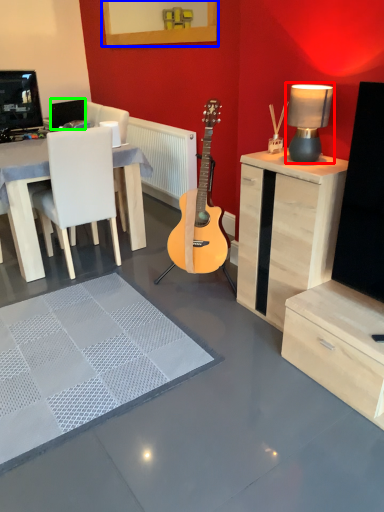
Question: Considering the real-world distances, which object is farthest from table lamp (highlighted by a red box)? picture frame (highlighted by a blue box) or speaker (highlighted by a green box)?

Choices:
 (A) picture frame
 (B) speaker

Answer: (B)